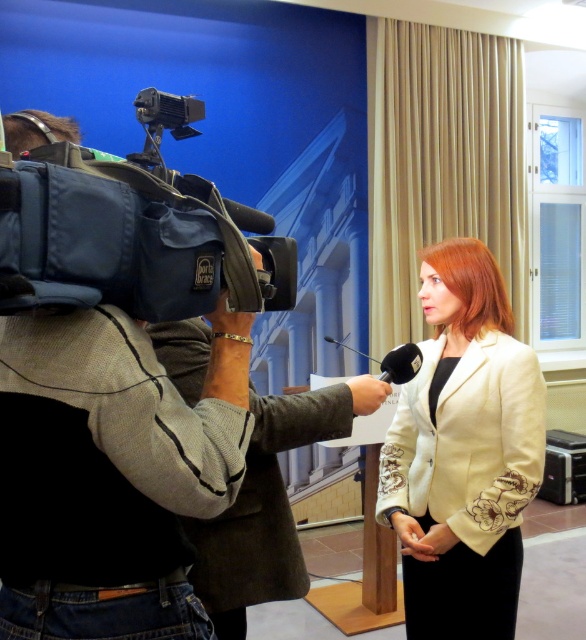
You are a photographer positioned to the side of the interview setup. You need to capture a clear photo of the dark gray wool business suit at center without the khaki fabric jacket at left blocking it. Is this possible?

The khaki fabric jacket at left is in front of the dark gray wool business suit at center, so it would block the view. To capture the dark gray wool business suit at center clearly, you would need to adjust your angle or position to avoid the khaki fabric jacket at left.

You are a fashion designer observing an interview setup. You notice the khaki fabric jacket at left and the creamy satin blazer at center. Which garment has a longer length?

The creamy satin blazer at center is longer than the khaki fabric jacket at left.

Looking at this image, you are a camera operator who needs to adjust the framing of your shot to include both the blue fabric video camera at left and the dark gray wool business suit at center. Which object is wider so that you can position it to fill the frame appropriately?

The blue fabric video camera at left is wider than the dark gray wool business suit at center, so you should position it to fill the frame appropriately.